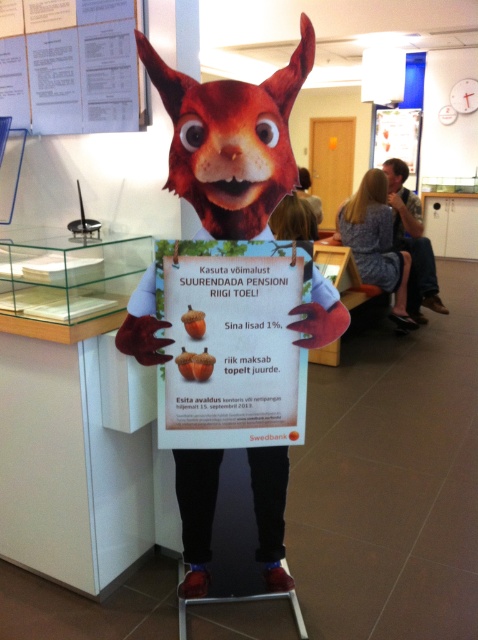
Question: Observing the image, what is the correct spatial positioning of matte orange poster at center in reference to denim jacket at upper right?

Choices:
 (A) below
 (B) above

Answer: (A)

Question: Can you confirm if matte orange poster at center is thinner than smooth brown hair at center?

Choices:
 (A) yes
 (B) no

Answer: (B)

Question: Which object is closer to the camera taking this photo?

Choices:
 (A) shiny plastic squirrel at upper center
 (B) smooth brown hair at center
 (C) matte orange poster at center
 (D) blonde hair at upper right

Answer: (A)

Question: Can you confirm if shiny plastic squirrel at upper center is positioned above denim jacket at upper right?

Choices:
 (A) yes
 (B) no

Answer: (B)

Question: Considering the real-world distances, which object is closest to the matte orange poster at center?

Choices:
 (A) denim jacket at upper right
 (B) white paper at upper left
 (C) shiny plastic squirrel at upper center
 (D) smooth brown hair at center

Answer: (C)

Question: Which object appears farthest from the camera in this image?

Choices:
 (A) smooth brown hair at center
 (B) denim jacket at upper right
 (C) matte orange poster at center

Answer: (B)